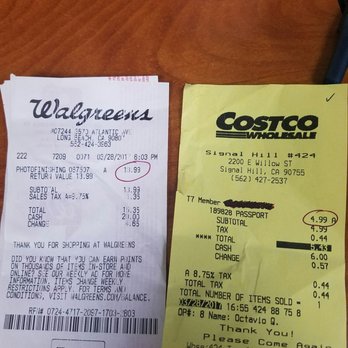
Locate an element on the screen. brown table is located at coordinates (176, 54).